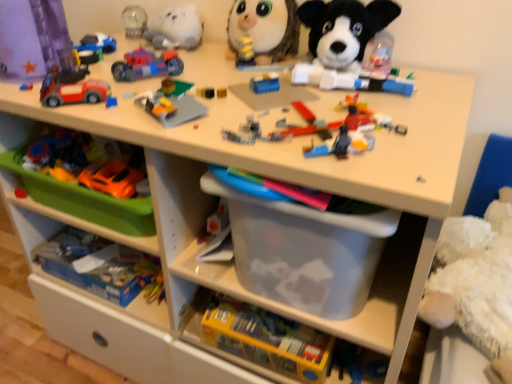
Locate an element on the screen. Image resolution: width=512 pixels, height=384 pixels. vacant region to the left of translucent plastic motorcycle at upper center, placed as the fourth toy when sorted from top to bottom is located at coordinates (72, 75).